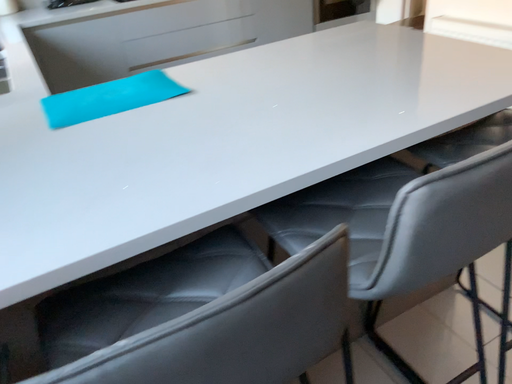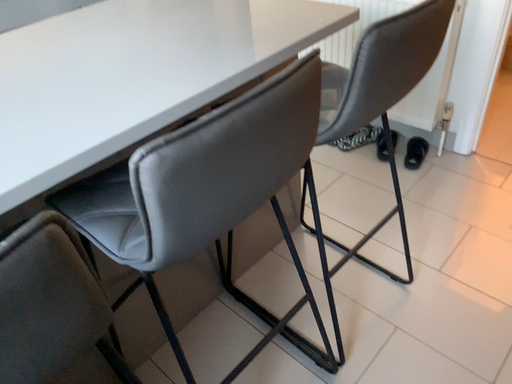
Question: How did the camera likely rotate when shooting the video?

Choices:
 (A) rotated right
 (B) rotated left

Answer: (A)